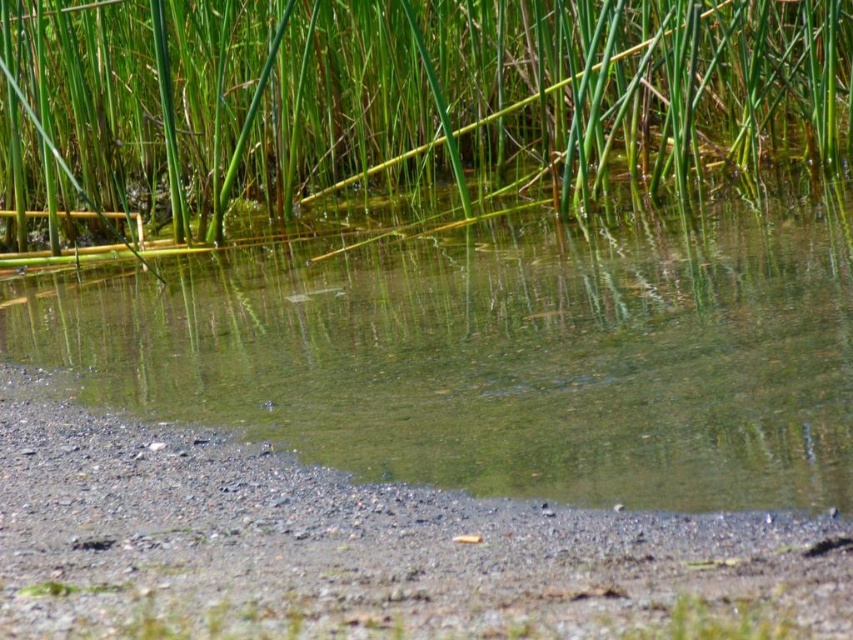
You are standing at the point marked as point (508, 353) in the scene. What do you see directly beneath your feet?

At point (508, 353) lies clear water at bottom, so you would see clear water beneath your feet.

You are a frog that needs to jump from the clear water at bottom to the green grass at upper center. Can you make the jump if your maximum jump distance is 2.5 meters?

The clear water at bottom and green grass at upper center are 3.03 meters apart from each other. Since your maximum jump distance is 2.5 meters, you cannot make the jump.